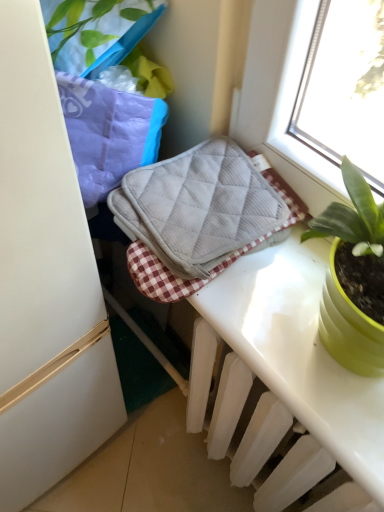
In order to face gray quilted oven mitt at center, should I rotate leftwards or rightwards?

You should rotate right by 5.474 degrees.

This screenshot has height=512, width=384. In order to click on gray quilted oven mitt at center in this screenshot , I will do `click(198, 206)`.

The image size is (384, 512). What do you see at coordinates (198, 206) in the screenshot? I see `gray quilted oven mitt at center` at bounding box center [198, 206].

The height and width of the screenshot is (512, 384). What do you see at coordinates (294, 475) in the screenshot?
I see `white plastic radiator at lower center` at bounding box center [294, 475].

Where is `white plastic radiator at lower center`? Image resolution: width=384 pixels, height=512 pixels. white plastic radiator at lower center is located at coordinates (294, 475).

Where is `gray quilted oven mitt at center`? The width and height of the screenshot is (384, 512). gray quilted oven mitt at center is located at coordinates (198, 206).

Can you confirm if gray quilted oven mitt at center is positioned to the left of white plastic radiator at lower center?

Yes.

Relative to white plastic radiator at lower center, is gray quilted oven mitt at center in front or behind?

Clearly, gray quilted oven mitt at center is behind white plastic radiator at lower center.

Does point (215, 169) appear closer or farther from the camera than point (352, 483)?

Point (215, 169) appears to be farther away from the viewer than point (352, 483).

From the image's perspective, is gray quilted oven mitt at center located beneath white plastic radiator at lower center?

No, from the image's perspective, gray quilted oven mitt at center is not beneath white plastic radiator at lower center.

From a real-world perspective, between gray quilted oven mitt at center and white plastic radiator at lower center, who is vertically higher?

gray quilted oven mitt at center.

Based on the photo, which of these two, gray quilted oven mitt at center or white plastic radiator at lower center, is thinner?

white plastic radiator at lower center.

Can you confirm if gray quilted oven mitt at center is taller than white plastic radiator at lower center?

Incorrect, the height of gray quilted oven mitt at center is not larger of that of white plastic radiator at lower center.

Does gray quilted oven mitt at center have a larger size compared to white plastic radiator at lower center?

Incorrect, gray quilted oven mitt at center is not larger than white plastic radiator at lower center.

Would you say gray quilted oven mitt at center is inside or outside white plastic radiator at lower center?

The correct answer is: outside.

Would you say gray quilted oven mitt at center is a long distance from white plastic radiator at lower center?

gray quilted oven mitt at center is actually quite close to white plastic radiator at lower center.

Is gray quilted oven mitt at center aimed at white plastic radiator at lower center?

No, gray quilted oven mitt at center is not oriented towards white plastic radiator at lower center.

What's the angular difference between gray quilted oven mitt at center and white plastic radiator at lower center's facing directions?

0.502 degrees.

In the image, there is a gray quilted oven mitt at center. At what (x,y) coordinates should I click in order to perform the action: click on radiator below it (from the image's perspective). Please return your answer as a coordinate pair (x, y). The image size is (384, 512). Looking at the image, I should click on (294, 475).

Between white plastic radiator at lower center and gray quilted oven mitt at center, which one appears on the right side from the viewer's perspective?

Positioned to the right is white plastic radiator at lower center.

Which is behind, white plastic radiator at lower center or gray quilted oven mitt at center?

gray quilted oven mitt at center.

Does point (325, 461) come behind point (264, 221)?

No, (325, 461) is in front of (264, 221).

Consider the image. From the image's perspective, is white plastic radiator at lower center above or below gray quilted oven mitt at center?

Clearly, from the image's perspective, white plastic radiator at lower center is below gray quilted oven mitt at center.

From a real-world perspective, is white plastic radiator at lower center over gray quilted oven mitt at center?

Incorrect, from a real-world perspective, white plastic radiator at lower center is lower than gray quilted oven mitt at center.

Considering the relative sizes of white plastic radiator at lower center and gray quilted oven mitt at center in the image provided, is white plastic radiator at lower center thinner than gray quilted oven mitt at center?

Yes.

From the picture: Who is shorter, white plastic radiator at lower center or gray quilted oven mitt at center?

gray quilted oven mitt at center is shorter.

Looking at this image, based on their sizes in the image, would you say white plastic radiator at lower center is bigger or smaller than gray quilted oven mitt at center?

Clearly, white plastic radiator at lower center is larger in size than gray quilted oven mitt at center.

Is white plastic radiator at lower center positioned beyond the bounds of gray quilted oven mitt at center?

Yes.

Is white plastic radiator at lower center not close to gray quilted oven mitt at center?

No, white plastic radiator at lower center is in close proximity to gray quilted oven mitt at center.

Is white plastic radiator at lower center oriented away from gray quilted oven mitt at center?

That's not correct — white plastic radiator at lower center is not looking away from gray quilted oven mitt at center.

Locate an element on the screen. The height and width of the screenshot is (512, 384). radiator below the gray quilted oven mitt at center (from the image's perspective) is located at coordinates (294, 475).

Locate an element on the screen. radiator below the gray quilted oven mitt at center (from the image's perspective) is located at coordinates (294, 475).

The image size is (384, 512). Find the location of `bath towel on the left of white plastic radiator at lower center`. bath towel on the left of white plastic radiator at lower center is located at coordinates (x=198, y=206).